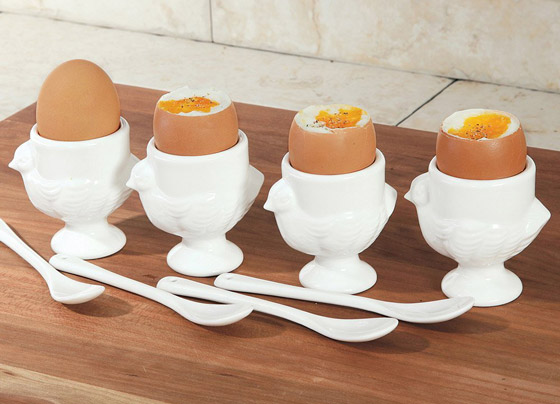
This screenshot has height=404, width=560. Find the location of `dish shadows`. dish shadows is located at coordinates (533, 284), (409, 259), (280, 252), (140, 235).